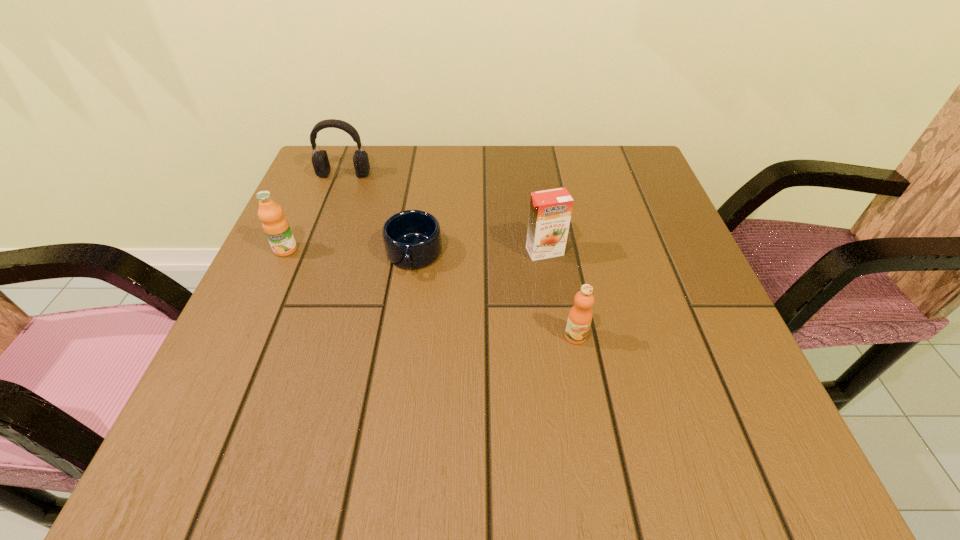
The height and width of the screenshot is (540, 960). Find the location of `headset`. headset is located at coordinates (320, 161).

Where is `the leftmost orange juice`? The image size is (960, 540). the leftmost orange juice is located at coordinates (276, 227).

You are a GUI agent. You are given a task and a screenshot of the screen. Output one action in this format:
    pyautogui.click(x=<x>, y=<y>)
    Task: Click on the nearest object
    The height and width of the screenshot is (540, 960).
    Given the screenshot: What is the action you would take?
    pyautogui.click(x=579, y=320)

This screenshot has width=960, height=540. Find the location of `the shortest object`. the shortest object is located at coordinates (412, 239).

Find the location of a particular element. This screenshot has height=540, width=960. mug is located at coordinates (412, 239).

In order to click on vacant region located 0.280m on the headband of the headset in this screenshot , I will do `click(311, 260)`.

Locate an element on the screen. Image resolution: width=960 pixels, height=540 pixels. vacant space located 0.170m on the label of the leftmost orange juice is located at coordinates (252, 325).

The image size is (960, 540). In order to click on free space located 0.150m on the front label of the nearest orange juice in this screenshot , I will do `click(593, 431)`.

The image size is (960, 540). In order to click on free space located 0.310m with the handle on the side of the shortest object in this screenshot , I will do `click(386, 437)`.

Where is `object at the far edge`? This screenshot has height=540, width=960. object at the far edge is located at coordinates (320, 161).